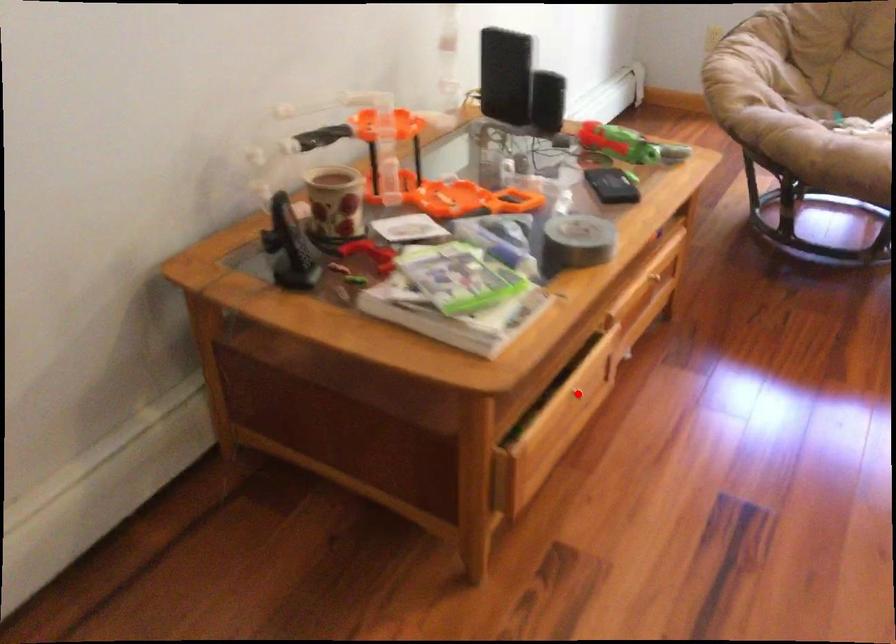
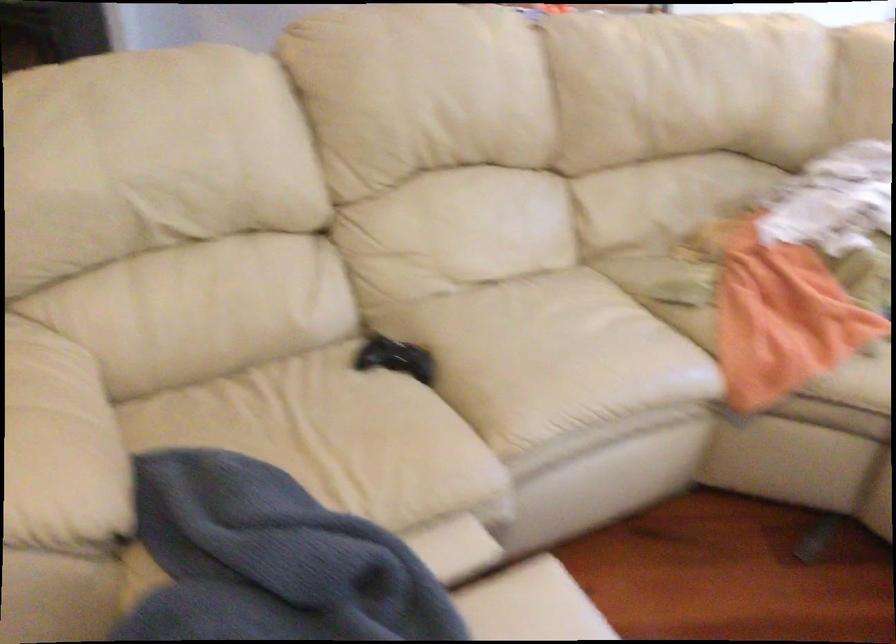
Question: I am providing you with two images of the same scene from different viewpoints. A red point is marked on the first image. Is the red point's position out of view in image 2?

Choices:
 (A) Yes
 (B) No

Answer: (A)